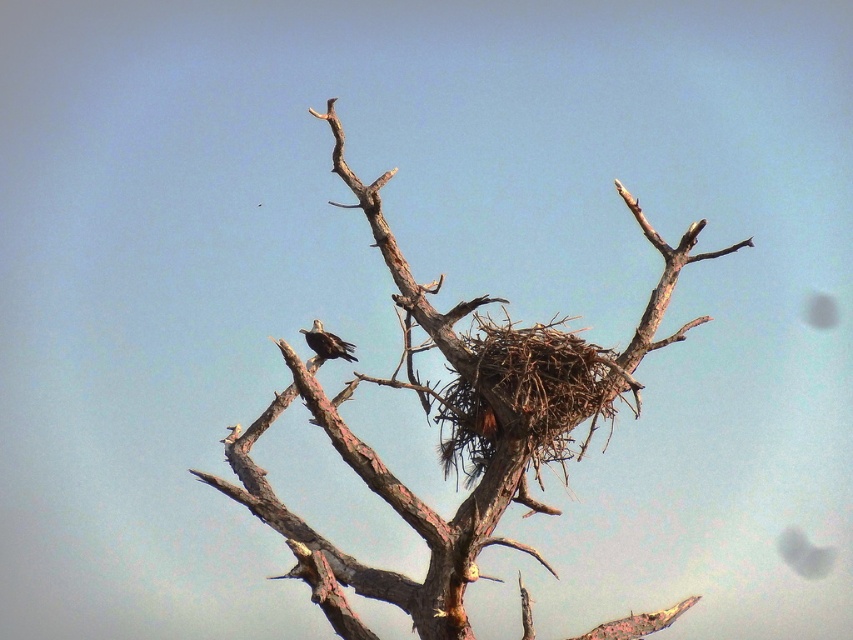
Question: Is brown/dry wood nest at upper center smaller than dark brown feathers at center?

Choices:
 (A) yes
 (B) no

Answer: (B)

Question: Is brown/dry wood nest at upper center to the right of dark brown feathers at center from the viewer's perspective?

Choices:
 (A) no
 (B) yes

Answer: (B)

Question: Does brown/dry wood nest at upper center appear on the right side of dark brown feathers at center?

Choices:
 (A) yes
 (B) no

Answer: (A)

Question: Which point is farther to the camera?

Choices:
 (A) dark brown feathers at center
 (B) brown/dry wood nest at upper center

Answer: (A)